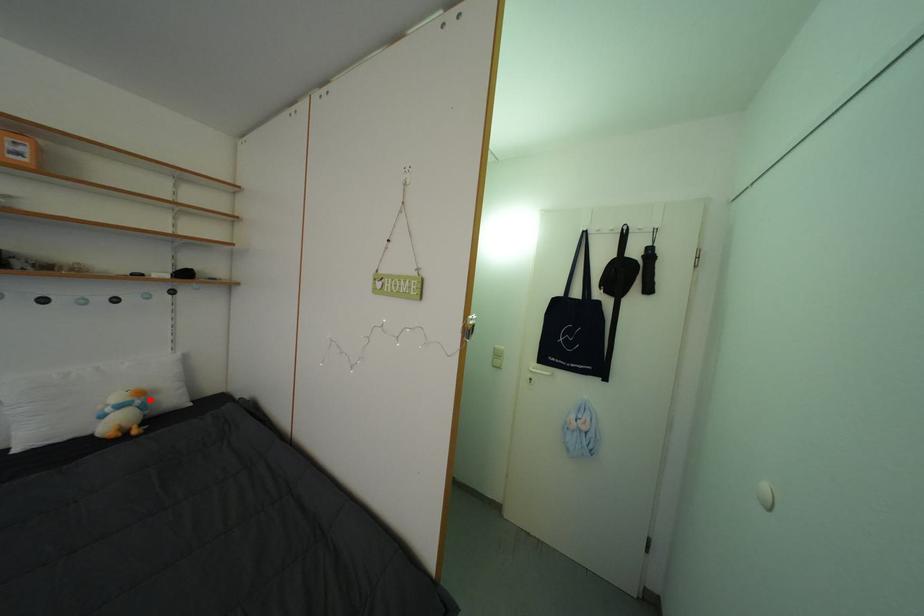
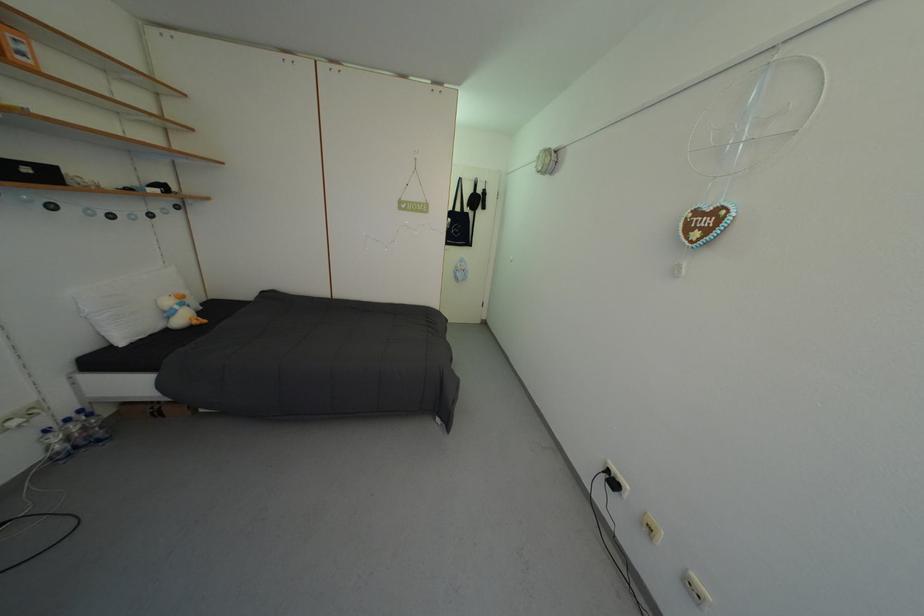
The point at the highlighted location is marked in the first image. Where is the corresponding point in the second image?

(190, 302)